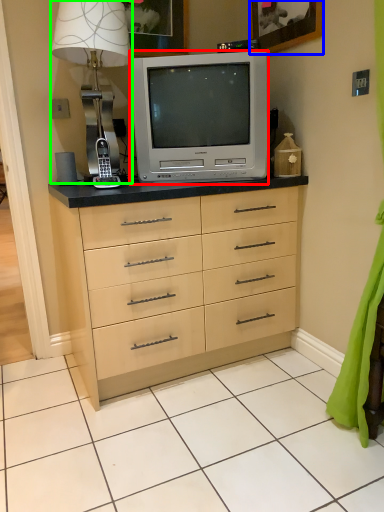
Question: Which object is positioned closest to television (highlighted by a red box)? Select from picture frame (highlighted by a blue box) and table lamp (highlighted by a green box).

Choices:
 (A) picture frame
 (B) table lamp

Answer: (B)